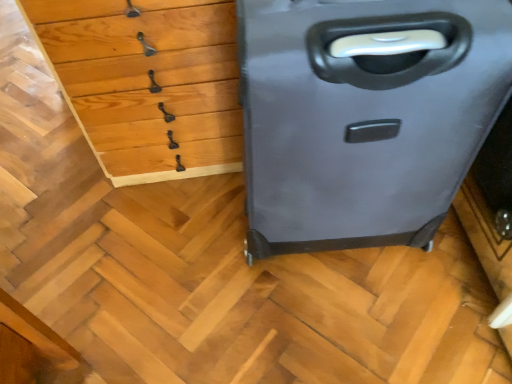
Question: In the image, is matte gray suitcase at right positioned in front of or behind wooden chest of drawers at upper left?

Choices:
 (A) behind
 (B) front

Answer: (B)

Question: Would you say matte gray suitcase at right is inside or outside wooden chest of drawers at upper left?

Choices:
 (A) inside
 (B) outside

Answer: (B)

Question: Is matte gray suitcase at right wider or thinner than wooden chest of drawers at upper left?

Choices:
 (A) thin
 (B) wide

Answer: (A)

Question: In the image, is wooden chest of drawers at upper left positioned in front of or behind matte gray suitcase at right?

Choices:
 (A) front
 (B) behind

Answer: (B)

Question: Based on their positions, is wooden chest of drawers at upper left located to the left or right of matte gray suitcase at right?

Choices:
 (A) left
 (B) right

Answer: (A)

Question: Is wooden chest of drawers at upper left taller or shorter than matte gray suitcase at right?

Choices:
 (A) tall
 (B) short

Answer: (B)

Question: Considering the positions of point (100, 72) and point (433, 9), is point (100, 72) closer or farther from the camera than point (433, 9)?

Choices:
 (A) farther
 (B) closer

Answer: (A)